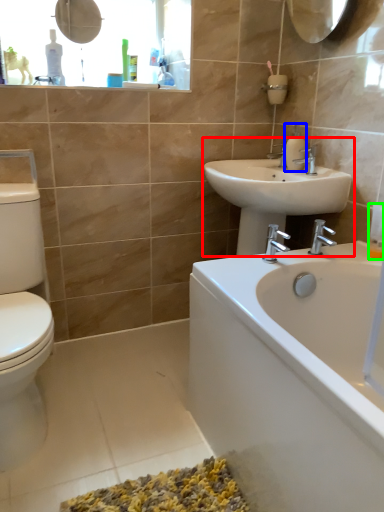
Question: Which object is the farthest from sink (highlighted by a red box)? Choose among these: soap dispenser (highlighted by a blue box) or toiletry (highlighted by a green box).

Choices:
 (A) soap dispenser
 (B) toiletry

Answer: (B)